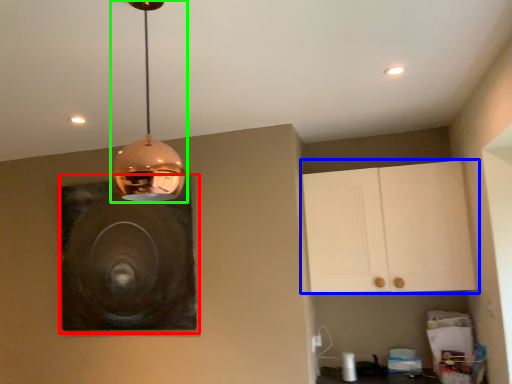
Question: Estimate the real-world distances between objects in this image. Which object is closer to picture frame (highlighted by a red box), cabinetry (highlighted by a blue box) or lamp (highlighted by a green box)?

Choices:
 (A) cabinetry
 (B) lamp

Answer: (A)